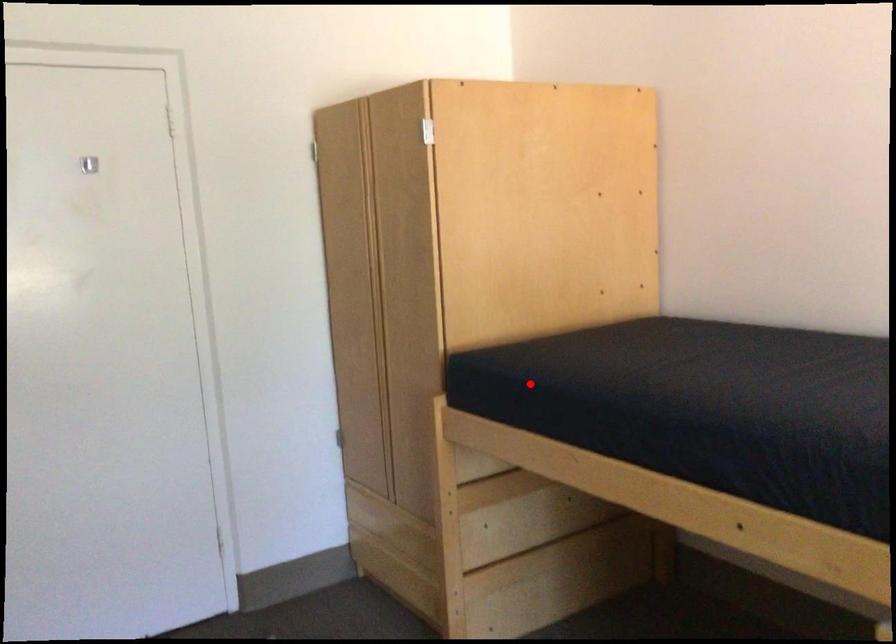
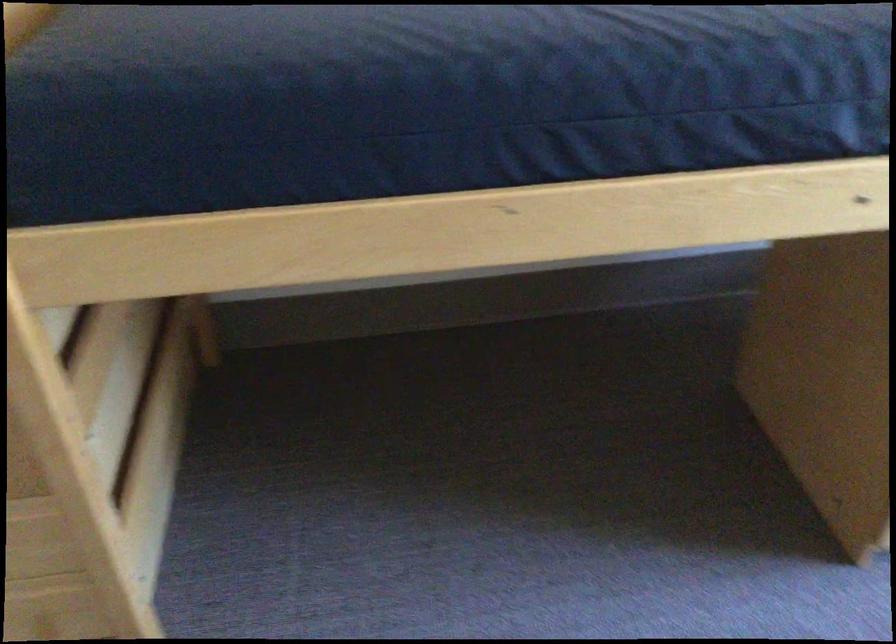
Question: I am providing you with two images of the same scene from different viewpoints. Given a red point in image1, look at the same physical point in image2. Is it:

Choices:
 (A) Closer to the viewpoint
 (B) Farther from the viewpoint

Answer: (A)